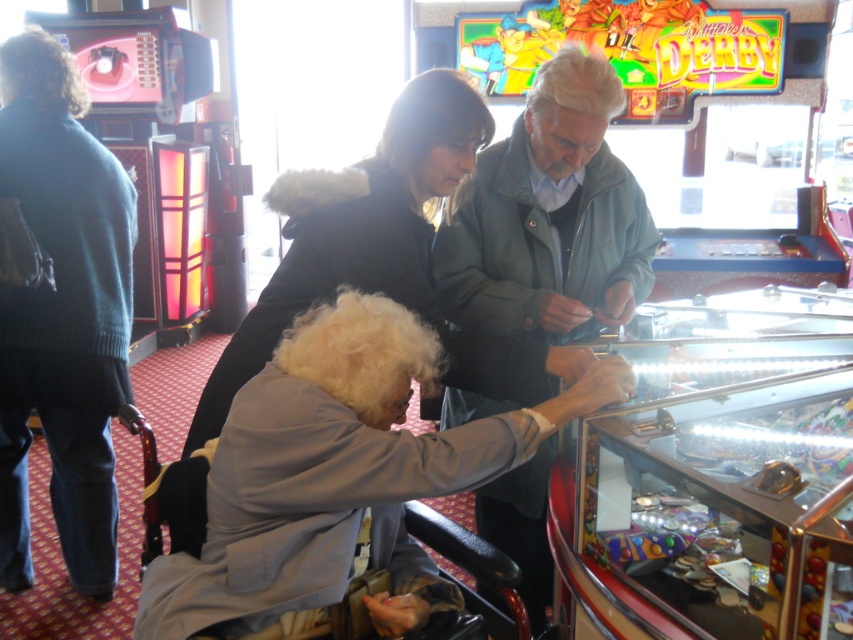
You are a delivery person who needs to place a small package between the gray fabric jacket at center and the dark blue sweater at left. The package is 1 meter long. Will it fit in the space between them?

The gray fabric jacket at center is 1.30 meters away from the dark blue sweater at left. Since the package is 1 meter long, it will fit comfortably in the space between them.